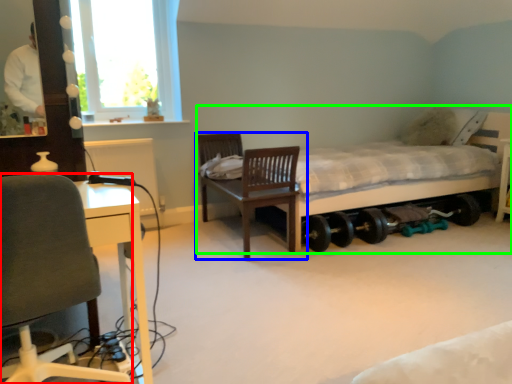
Question: Which object is positioned farthest from chair (highlighted by a red box)? Select from chair (highlighted by a blue box) and bed (highlighted by a green box).

Choices:
 (A) chair
 (B) bed

Answer: (B)